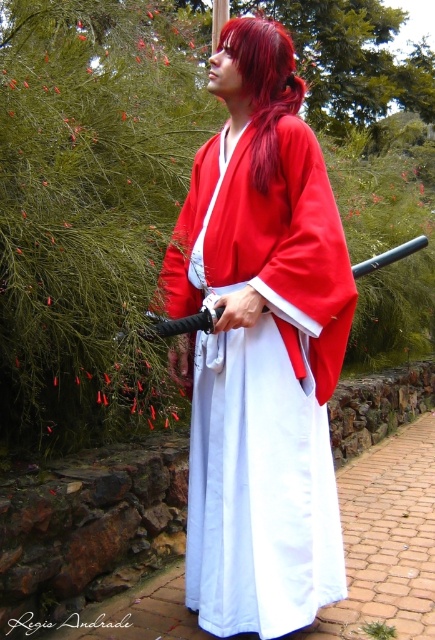
Question: Which point is farther from the camera taking this photo?

Choices:
 (A) (253, 147)
 (B) (271, 33)

Answer: (B)

Question: Can you confirm if matte red kimono at center is smaller than shiny red hair at center?

Choices:
 (A) no
 (B) yes

Answer: (A)

Question: Does matte red kimono at center have a smaller size compared to shiny red hair at center?

Choices:
 (A) yes
 (B) no

Answer: (B)

Question: Is matte red kimono at center bigger than shiny red hair at center?

Choices:
 (A) yes
 (B) no

Answer: (A)

Question: Which of the following is the closest to the observer?

Choices:
 (A) shiny red hair at center
 (B) matte red kimono at center

Answer: (B)

Question: Which object is closer to the camera taking this photo?

Choices:
 (A) shiny red hair at center
 (B) matte red kimono at center

Answer: (B)